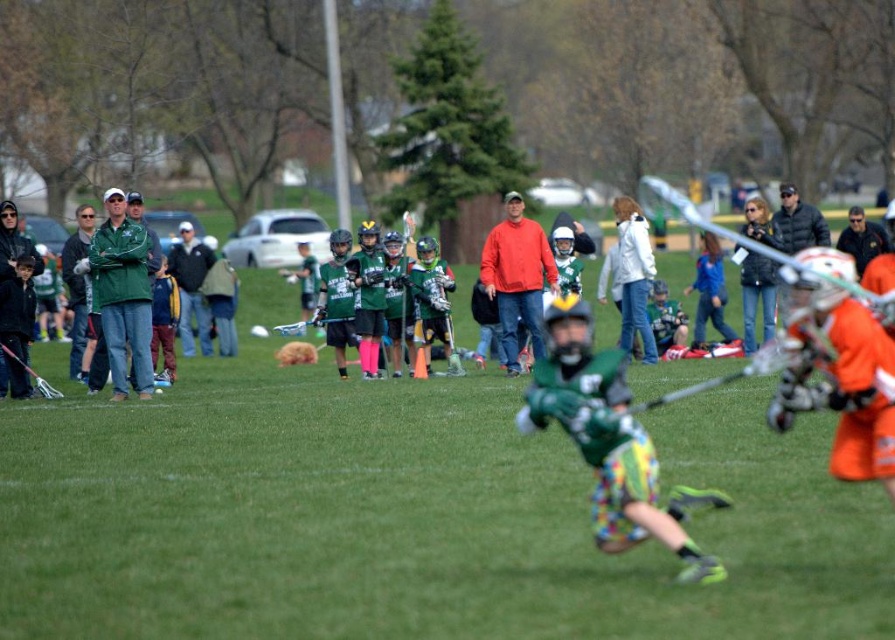
How distant is green matte jersey at center from orange fleece jacket at center?

green matte jersey at center is 40.01 feet away from orange fleece jacket at center.

Measure the distance between green matte jersey at center and camera.

green matte jersey at center and camera are 26.26 feet apart from each other.

Which is behind, point (578, 317) or point (522, 268)?

The point (522, 268) is more distant.

I want to click on green matte jersey at center, so click(610, 442).